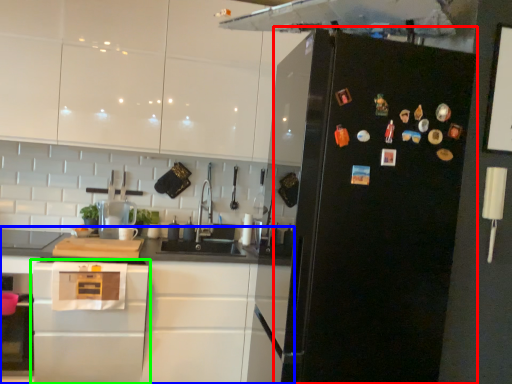
Question: Which is nearer to the refrigerator (highlighted by a red box)? cabinetry (highlighted by a blue box) or home appliance (highlighted by a green box).

Choices:
 (A) cabinetry
 (B) home appliance

Answer: (A)